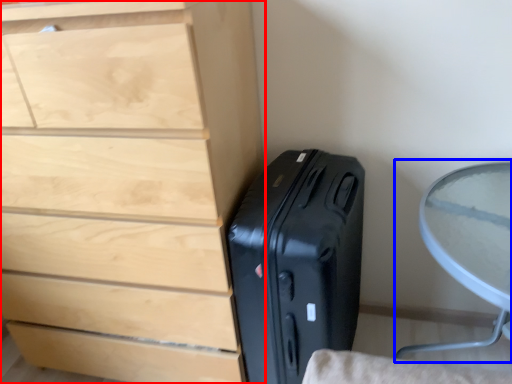
Question: Which object is closer to the camera taking this photo, chest of drawers (highlighted by a red box) or round table (highlighted by a blue box)?

Choices:
 (A) chest of drawers
 (B) round table

Answer: (B)